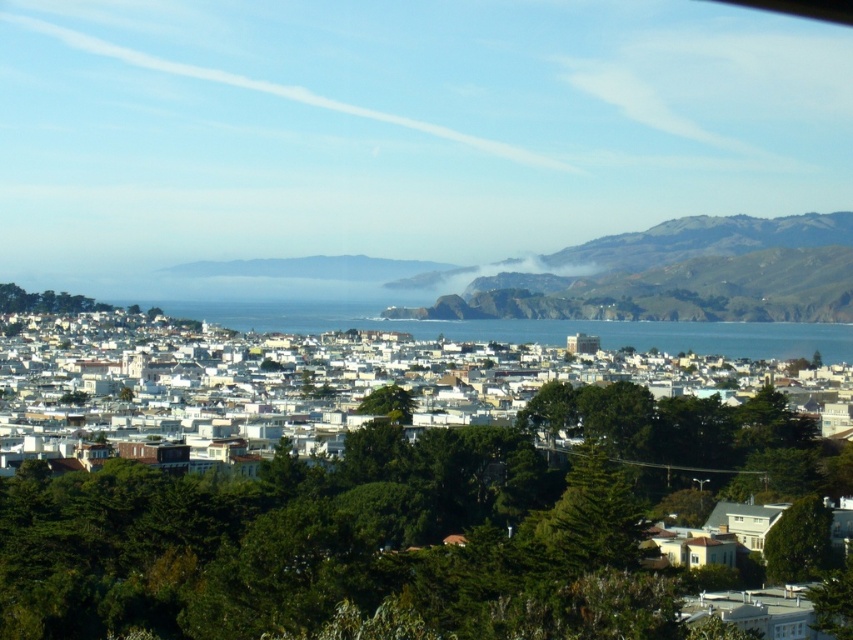
You are a city planner assessing the coastal area. You need to determine if the white matte buildings at center are within the required 20 meters setback from the blue water at center. Is this the case?

The white matte buildings at center are 21.22 meters from the blue water at center, which exceeds the required 20 meters setback. Therefore, they are within the setback requirement.

You are a tourist standing at the top of a hill overlooking the coastal city. You notice the white matte buildings at center and the blue water at center. Which one is closer to you?

The white matte buildings at center are closer to you since they are positioned in front of the blue water at center.

You are a drone operator trying to capture a photo of the white matte buildings at center. The drone is currently at the point marked by point [389,387]. Can you confirm if the drone is positioned directly above the white matte buildings at center?

Yes, the point [389,387] represents the white matte buildings at center, so the drone is positioned directly above the white matte buildings at center.